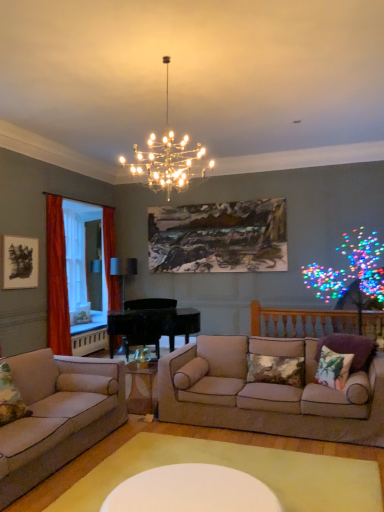
Question: Could you tell me if floral fabric pillow at right, the second pillow from the right, is turned towards translucent fabric curtain at left, positioned as the 2th window screen in back-to-front order?

Choices:
 (A) no
 (B) yes

Answer: (A)

Question: From the image's perspective, is floral fabric pillow at right, placed as the second pillow when sorted from left to right, on top of translucent fabric curtain at left, the 1th window screen when ordered from front to back?

Choices:
 (A) no
 (B) yes

Answer: (A)

Question: Is floral fabric pillow at right, the second pillow from the right, surrounding translucent fabric curtain at left, the 1th window screen when ordered from front to back?

Choices:
 (A) yes
 (B) no

Answer: (B)

Question: Is the surface of floral fabric pillow at right, placed as the second pillow when sorted from left to right, in direct contact with translucent fabric curtain at left, positioned as the 2th window screen in back-to-front order?

Choices:
 (A) no
 (B) yes

Answer: (A)

Question: Is the position of floral fabric pillow at right, the second pillow from the right, more distant than that of translucent fabric curtain at left, the 1th window screen when ordered from front to back?

Choices:
 (A) yes
 (B) no

Answer: (B)

Question: From their relative heights in the image, would you say black matte picture frame at upper left, the 1th picture frame from the left, is taller or shorter than oil painting at upper center, positioned as the 2th picture frame in front-to-back order?

Choices:
 (A) tall
 (B) short

Answer: (B)

Question: Would you say black matte picture frame at upper left, which ranks as the first picture frame in front-to-back order, is to the left or to the right of oil painting at upper center, the second picture frame when ordered from left to right, in the picture?

Choices:
 (A) left
 (B) right

Answer: (A)

Question: Does point (29, 239) appear closer or farther from the camera than point (284, 214)?

Choices:
 (A) farther
 (B) closer

Answer: (B)

Question: Which is correct: black matte picture frame at upper left, the 1th picture frame from the left, is inside oil painting at upper center, arranged as the 1th picture frame when viewed from the right, or outside of it?

Choices:
 (A) inside
 (B) outside

Answer: (B)

Question: Considering their positions, is matte black lamp at center, positioned as the 2th lamp in front-to-back order, located in front of or behind metallic chandelier at upper center, the 1th lamp from the right?

Choices:
 (A) behind
 (B) front

Answer: (A)

Question: From a real-world perspective, relative to metallic chandelier at upper center, positioned as the 2th lamp in back-to-front order, is matte black lamp at center, placed as the first lamp when sorted from bottom to top, vertically above or below?

Choices:
 (A) below
 (B) above

Answer: (A)

Question: Is matte black lamp at center, placed as the first lamp when sorted from bottom to top, bigger or smaller than metallic chandelier at upper center, the 1th lamp from the right?

Choices:
 (A) small
 (B) big

Answer: (A)

Question: Choose the correct answer: Is matte black lamp at center, the first lamp when ordered from back to front, inside metallic chandelier at upper center, the 1th lamp when ordered from front to back, or outside it?

Choices:
 (A) inside
 (B) outside

Answer: (B)

Question: Based on their sizes in the image, would you say textured beige pillow at center, which appears as the first pillow when viewed from the left, is bigger or smaller than translucent fabric curtain at left, the 1th window screen when ordered from front to back?

Choices:
 (A) small
 (B) big

Answer: (A)

Question: Looking at their shapes, would you say textured beige pillow at center, which appears as the first pillow when viewed from the left, is wider or thinner than translucent fabric curtain at left, positioned as the 2th window screen in back-to-front order?

Choices:
 (A) thin
 (B) wide

Answer: (A)